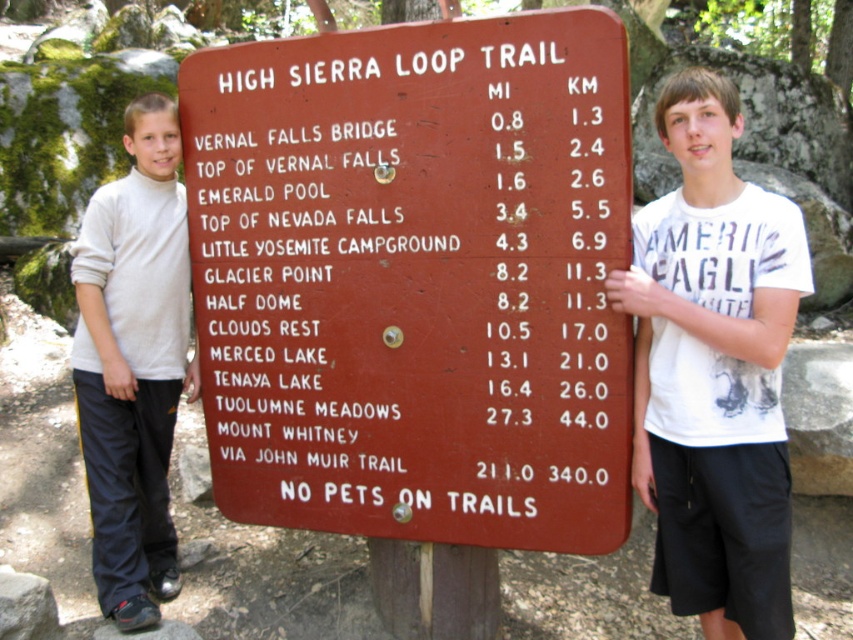
Based on the image of the trail sign, which of the two points, point 1 at coordinates (399, 33) or point 2 at coordinates (730, 202), is positioned further back from the viewer?

Point 1 at coordinates (399, 33) is positioned further back from the viewer compared to point 2 at coordinates (730, 202).